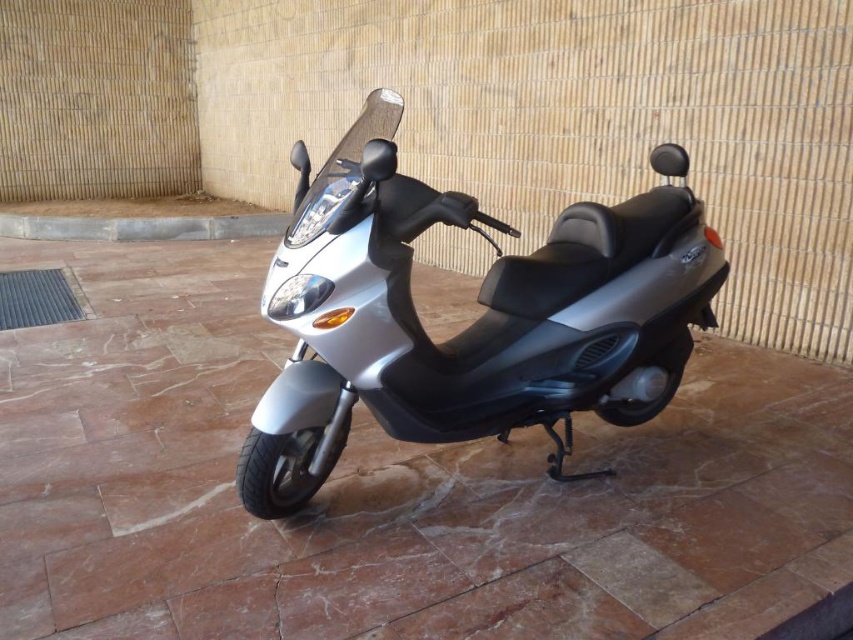
You are standing 6 feet away from the silver metallic scooter at center. If you take a step forward, will you be closer to the scooter than the distance specified in the scene description?

The silver metallic scooter at center is 5.20 feet from viewer. Since you are initially 6 feet away and take a step forward, you would be closer than the specified distance of 5.20 feet. However, the scene description states the scooter is already at 5.20 feet from the viewer, so your current position might not align with the scene. Please adjust your position to match the scene description first.

You are standing at the point with coordinates 0.5, 0.5 in a tiled area. You see the silver metallic scooter at center. What is the direction you need to move to reach the scooter?

You need to move northeast to reach the silver metallic scooter at center because it is located at point [473,323], which is northeast of your current position at [426,320].